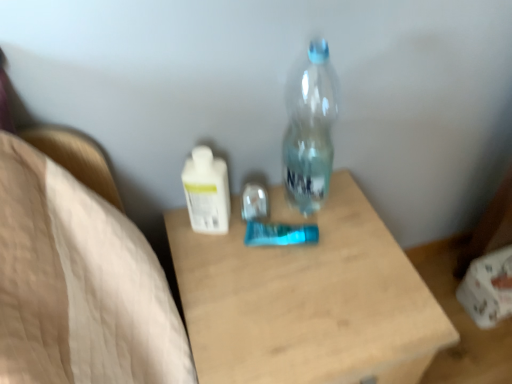
Where is `vacant area that lies in front of white glossy lotion at center, the 1th bottle viewed from the left`? The height and width of the screenshot is (384, 512). vacant area that lies in front of white glossy lotion at center, the 1th bottle viewed from the left is located at coordinates (232, 286).